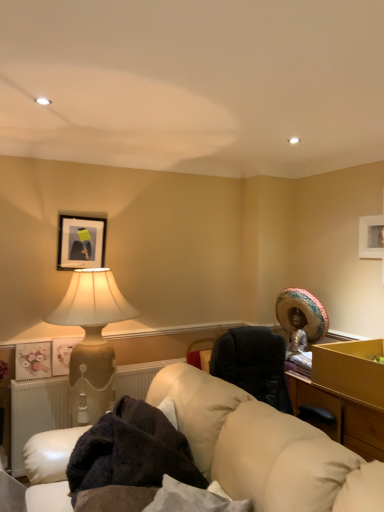
Question: From the image's perspective, relative to matte floral print at left, which is counted as the 3th picture frame, starting from the top, is matte gold picture frame at left, which is the 2th picture frame in bottom-to-top order, above or below?

Choices:
 (A) below
 (B) above

Answer: (B)

Question: Considering the positions of matte gold picture frame at left, which ranks as the second picture frame in top-to-bottom order, and matte floral print at left, which appears as the 1th picture frame when ordered from the bottom, in the image, is matte gold picture frame at left, which ranks as the second picture frame in top-to-bottom order, bigger or smaller than matte floral print at left, which appears as the 1th picture frame when ordered from the bottom,?

Choices:
 (A) small
 (B) big

Answer: (B)

Question: Which object is the closest to the matte black picture frame at upper left, placed as the 3th picture frame when sorted from bottom to top?

Choices:
 (A) leather couch at lower center
 (B) matte gold picture frame at left, which is the 2th picture frame in bottom-to-top order
 (C) white radiator at lower left
 (D) matte floral print at left, which appears as the 1th picture frame when ordered from the bottom
 (E) matte beige lamp at left

Answer: (E)

Question: Estimate the real-world distances between objects in this image. Which object is closer to the dark brown plush blanket at lower center?

Choices:
 (A) white radiator at lower left
 (B) matte gold picture frame at left, which is the 2th picture frame in bottom-to-top order
 (C) matte beige lamp at left
 (D) leather couch at lower center
 (E) matte black picture frame at upper left, placed as the 3th picture frame when sorted from bottom to top

Answer: (D)